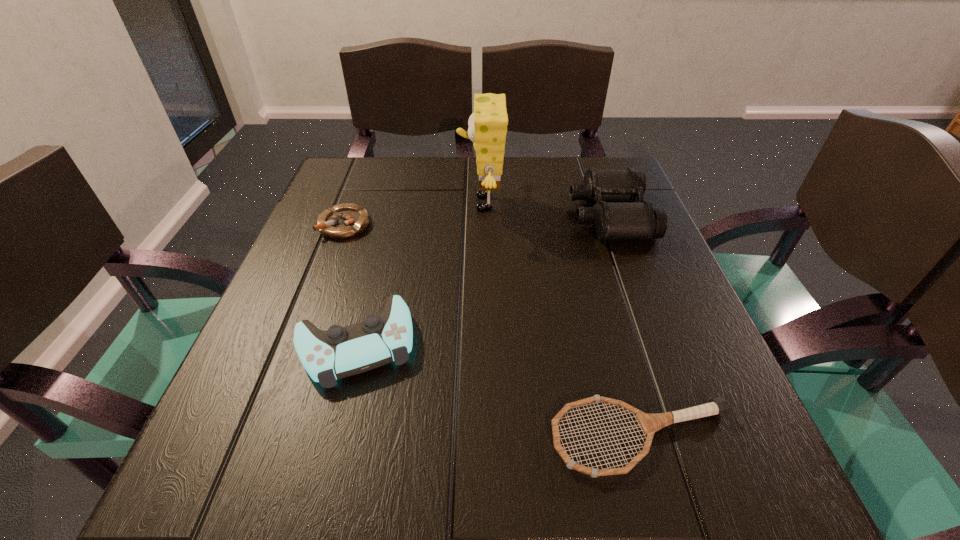
Locate an element on the screen. The image size is (960, 540). the third object from left to right is located at coordinates (487, 129).

Where is `the tallest object`? The width and height of the screenshot is (960, 540). the tallest object is located at coordinates [x=487, y=129].

You are a GUI agent. You are given a task and a screenshot of the screen. Output one action in this format:
    pyautogui.click(x=<x>, y=<y>)
    Task: Click on the binoculars
    
    Given the screenshot: What is the action you would take?
    click(615, 216)

The width and height of the screenshot is (960, 540). I want to click on control, so click(x=340, y=352).

This screenshot has width=960, height=540. Identify the location of the second nearest object. (340, 352).

Where is `ashtray`? ashtray is located at coordinates (343, 221).

This screenshot has width=960, height=540. In order to click on tennis racket in this screenshot , I will do `click(649, 423)`.

You are a GUI agent. You are given a task and a screenshot of the screen. Output one action in this format:
    pyautogui.click(x=<x>, y=<y>)
    Task: Click on the vacant space located on the front-facing side of the tallest object
    
    Given the screenshot: What is the action you would take?
    pyautogui.click(x=398, y=203)

Locate an element on the screen. Image resolution: width=960 pixels, height=540 pixels. vacant point located on the front-facing side of the tallest object is located at coordinates point(398,203).

I want to click on vacant area situated 0.100m on the front-facing side of the tallest object, so click(x=416, y=203).